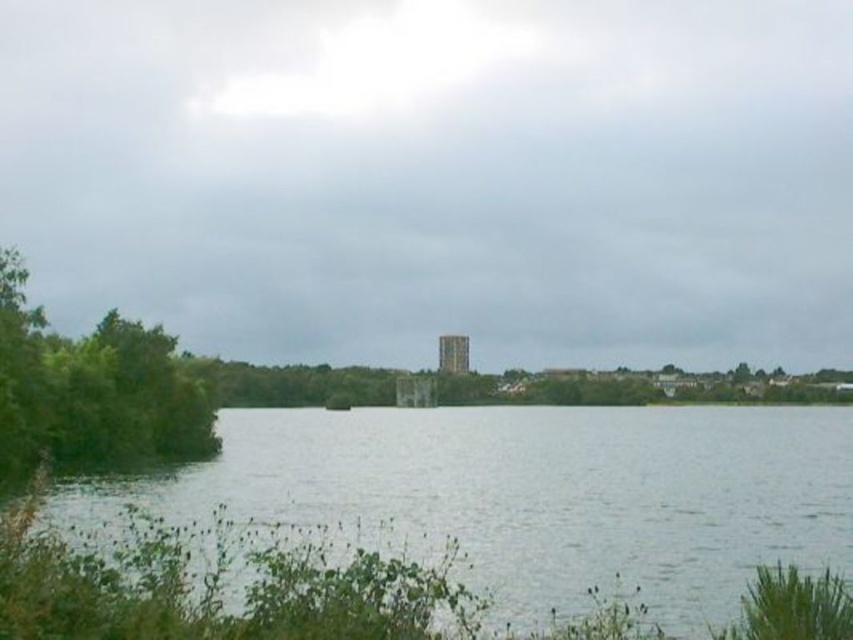
In the scene shown: You are standing at the center of the image and want to walk towards the green water at lower center. Which direction should you move in?

Result: Since the green water at lower center is located at coordinates approximately 0.769 on the x axis and 0.637 on the y axis, you should move towards the lower right direction from the center to reach it.

You are standing at the lakeside and want to take a photo of the green leafy tree at left and the green water at lower center. Based on their positions, which object should you place on the left side of your photo frame?

The green leafy tree at left should be placed on the left side of your photo frame because the green water at lower center is positioned on the right side of it.

You are standing at the edge of the lake and want to reach the brown stone tower at center. The green water at lower center is between you and the tower. Can you walk directly to the tower without getting wet?

The green water at lower center is 58.94 meters away from the brown stone tower at center, so you would have to walk through the water to reach the tower, which means you would get wet.